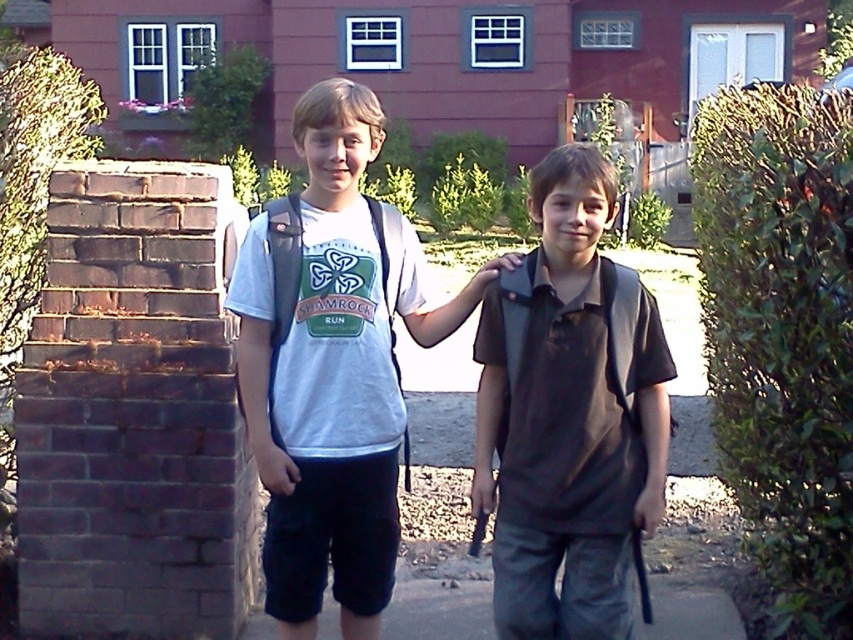
Question: In this image, where is dark brown shirt at center located relative to white matte t-shirt at center?

Choices:
 (A) right
 (B) left

Answer: (A)

Question: Is dark brown shirt at center thinner than gray concrete pavement at lower center?

Choices:
 (A) no
 (B) yes

Answer: (B)

Question: Among these objects, which one is nearest to the camera?

Choices:
 (A) white matte t-shirt at center
 (B) gray concrete pavement at lower center
 (C) dark brown shirt at center

Answer: (C)

Question: Which of the following is the closest to the observer?

Choices:
 (A) click(x=741, y=637)
 (B) click(x=288, y=588)
 (C) click(x=550, y=368)

Answer: (C)

Question: Considering the real-world distances, which object is closest to the gray concrete pavement at lower center?

Choices:
 (A) white matte t-shirt at center
 (B) dark brown shirt at center

Answer: (A)

Question: Does white matte t-shirt at center have a smaller size compared to gray concrete pavement at lower center?

Choices:
 (A) yes
 (B) no

Answer: (B)